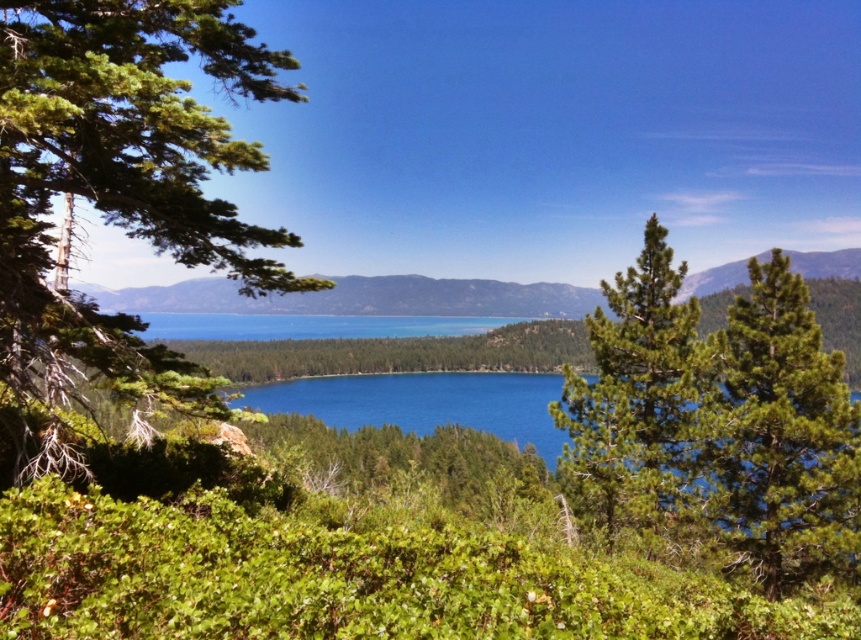
Does green leafy tree at left appear over green needle-like at center?

Indeed, green leafy tree at left is positioned over green needle-like at center.

In the scene shown: Is green leafy tree at left bigger than green needle-like at center?

Correct, green leafy tree at left is larger in size than green needle-like at center.

What do you see at coordinates (119, 195) in the screenshot? I see `green leafy tree at left` at bounding box center [119, 195].

Where is `green leafy tree at left`? The width and height of the screenshot is (861, 640). green leafy tree at left is located at coordinates (119, 195).

Who is more distant from viewer, (751, 460) or (562, 484)?

The point (562, 484) is more distant.

Is green needle-like at right further to the viewer compared to green needle-like at center?

Yes, green needle-like at right is behind green needle-like at center.

Which is behind, point (846, 552) or point (653, 413)?

Point (653, 413)

Find the location of a particular element. Image resolution: width=861 pixels, height=640 pixels. green needle-like at right is located at coordinates (779, 436).

Is green leafy tree at left to the left of green needle-like at right from the viewer's perspective?

Yes, green leafy tree at left is to the left of green needle-like at right.

Is green leafy tree at left smaller than green needle-like at right?

Incorrect, green leafy tree at left is not smaller in size than green needle-like at right.

Which is behind, point (84, 67) or point (807, 385)?

The point (807, 385) is behind.

This screenshot has width=861, height=640. Identify the location of green leafy tree at left. (119, 195).